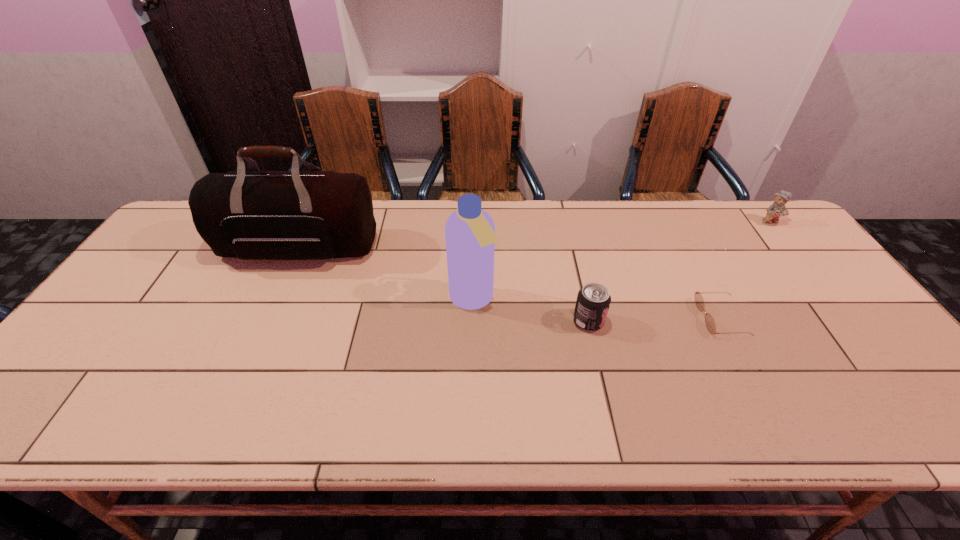
At what (x,y) coordinates should I click in order to perform the action: click on the leftmost object. Please return your answer as a coordinate pair (x, y). The width and height of the screenshot is (960, 540). Looking at the image, I should click on (253, 215).

Where is `shampoo`? The height and width of the screenshot is (540, 960). shampoo is located at coordinates (470, 236).

The image size is (960, 540). I want to click on the rightmost object, so click(777, 209).

Where is `soda can`? soda can is located at coordinates (593, 301).

The width and height of the screenshot is (960, 540). What are the coordinates of `sunglasses` in the screenshot? It's located at (709, 321).

Where is `the shortest object`? Image resolution: width=960 pixels, height=540 pixels. the shortest object is located at coordinates tap(709, 321).

Where is `vacant space located on the front pocket of the leftmost object`? The width and height of the screenshot is (960, 540). vacant space located on the front pocket of the leftmost object is located at coordinates (265, 321).

Identify the location of vacant space situated 0.300m on the right of the fourth object from right to left. The height and width of the screenshot is (540, 960). (607, 300).

At what (x,y) coordinates should I click in order to perform the action: click on blank area located on the front-facing side of the rightmost object. Please return your answer as a coordinate pair (x, y). This screenshot has height=540, width=960. Looking at the image, I should click on (803, 263).

Locate an element on the screen. The height and width of the screenshot is (540, 960). vacant space positioned 0.180m on the right of the soda can is located at coordinates (674, 321).